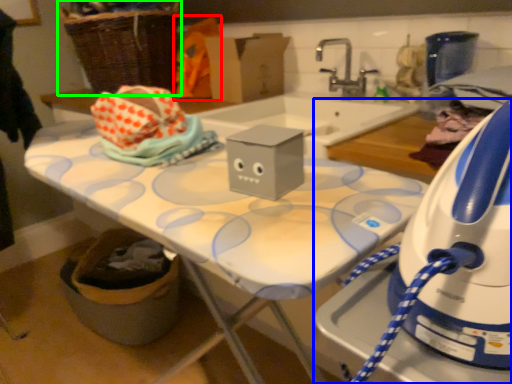
Question: Which is farther away from fabric (highlighted by a red box)? home appliance (highlighted by a blue box) or basket (highlighted by a green box)?

Choices:
 (A) home appliance
 (B) basket

Answer: (A)